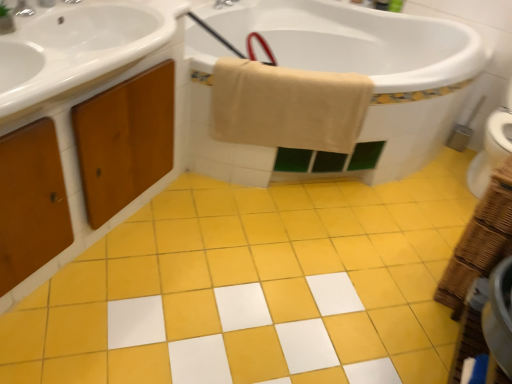
Question: Can you confirm if brushed metal faucet at upper center, acting as the second tap starting from the front, is thinner than yellow matte tile at center?

Choices:
 (A) yes
 (B) no

Answer: (A)

Question: Is brushed metal faucet at upper center, which ranks as the second tap in left-to-right order, taller than yellow matte tile at center?

Choices:
 (A) yes
 (B) no

Answer: (A)

Question: From a real-world perspective, does brushed metal faucet at upper center, marked as the 1th tap in a right-to-left arrangement, sit lower than yellow matte tile at center?

Choices:
 (A) yes
 (B) no

Answer: (B)

Question: Considering the relative sizes of brushed metal faucet at upper center, placed as the 2th tap when sorted from bottom to top, and yellow matte tile at center in the image provided, is brushed metal faucet at upper center, placed as the 2th tap when sorted from bottom to top, shorter than yellow matte tile at center?

Choices:
 (A) yes
 (B) no

Answer: (B)

Question: Is brushed metal faucet at upper center, placed as the 2th tap when sorted from bottom to top, located outside yellow matte tile at center?

Choices:
 (A) no
 (B) yes

Answer: (B)

Question: From a real-world perspective, is metallic silver brush at right physically located above or below brushed metal faucet at upper left, arranged as the first tap when ordered from the bottom?

Choices:
 (A) above
 (B) below

Answer: (B)

Question: Choose the correct answer: Is metallic silver brush at right inside brushed metal faucet at upper left, which ranks as the 2th tap in right-to-left order, or outside it?

Choices:
 (A) outside
 (B) inside

Answer: (A)

Question: From the image's perspective, is metallic silver brush at right positioned above or below brushed metal faucet at upper left, arranged as the first tap when ordered from the bottom?

Choices:
 (A) above
 (B) below

Answer: (B)

Question: Considering the positions of metallic silver brush at right and brushed metal faucet at upper left, which is counted as the first tap, starting from the front, in the image, is metallic silver brush at right wider or thinner than brushed metal faucet at upper left, which is counted as the first tap, starting from the front,?

Choices:
 (A) wide
 (B) thin

Answer: (A)

Question: Based on their positions, is white glossy bathtub at upper center located to the left or right of wooden cabinet at left?

Choices:
 (A) right
 (B) left

Answer: (A)

Question: Is point (270, 153) closer or farther from the camera than point (82, 1)?

Choices:
 (A) closer
 (B) farther

Answer: (B)

Question: In terms of width, does white glossy bathtub at upper center look wider or thinner when compared to wooden cabinet at left?

Choices:
 (A) wide
 (B) thin

Answer: (A)

Question: From the image's perspective, is white glossy bathtub at upper center positioned above or below wooden cabinet at left?

Choices:
 (A) above
 (B) below

Answer: (A)

Question: From a real-world perspective, is brushed metal faucet at upper center, marked as the 1th tap in a right-to-left arrangement, positioned above or below brushed metal faucet at upper left, which ranks as the 2th tap in right-to-left order?

Choices:
 (A) above
 (B) below

Answer: (B)

Question: Considering the positions of point (233, 1) and point (23, 9), is point (233, 1) closer or farther from the camera than point (23, 9)?

Choices:
 (A) farther
 (B) closer

Answer: (A)